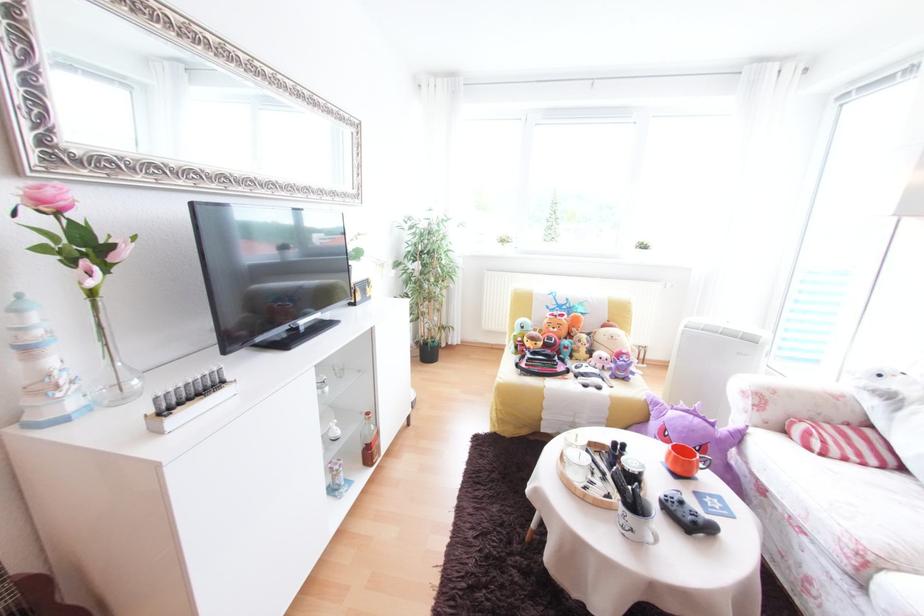
The image size is (924, 616). Find the location of `grey game controller`. grey game controller is located at coordinates (687, 515).